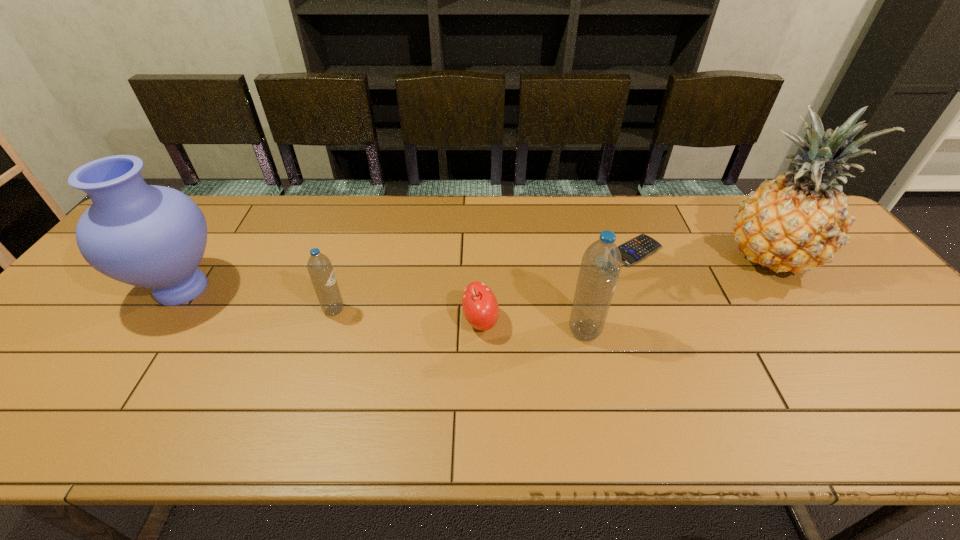
Where is `object at the right edge`? The image size is (960, 540). object at the right edge is located at coordinates (796, 222).

What are the coordinates of `object at the far right corner` in the screenshot? It's located at (796, 222).

Image resolution: width=960 pixels, height=540 pixels. I want to click on free space at the far edge, so click(x=456, y=212).

What are the coordinates of `vacant region at the near edge` in the screenshot? It's located at (74, 399).

At what (x,y) coordinates should I click in order to perform the action: click on free region at the right edge. Please return your answer as a coordinate pair (x, y). This screenshot has height=540, width=960. Looking at the image, I should click on (910, 324).

Where is `free space between the shortest object and the second object from left to right`? The height and width of the screenshot is (540, 960). free space between the shortest object and the second object from left to right is located at coordinates (485, 280).

I want to click on blank region between the calculator and the vase, so [409, 269].

Locate an element on the screen. This screenshot has width=960, height=540. empty space that is in between the shortest object and the second object from left to right is located at coordinates (485, 280).

This screenshot has height=540, width=960. What are the coordinates of `vacant space that's between the vase and the fourth object from left to right` in the screenshot? It's located at (383, 310).

Image resolution: width=960 pixels, height=540 pixels. I want to click on free area in between the rightmost object and the calculator, so click(702, 254).